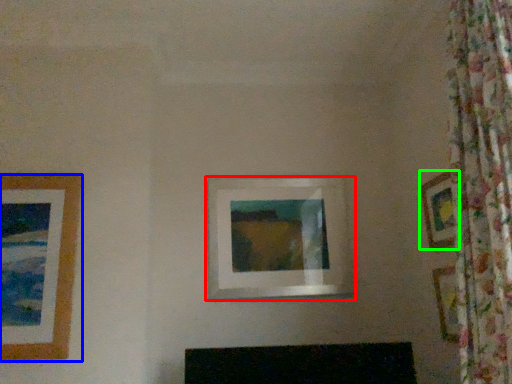
Question: Considering the real-world distances, which object is closest to picture frame (highlighted by a red box)? picture frame (highlighted by a blue box) or picture frame (highlighted by a green box).

Choices:
 (A) picture frame
 (B) picture frame

Answer: (B)